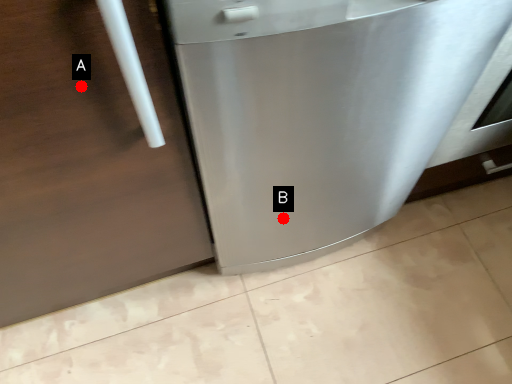
Question: Two points are circled on the image, labeled by A and B beside each circle. Which of the following is the farthest from the observer?

Choices:
 (A) A is further
 (B) B is further

Answer: (B)